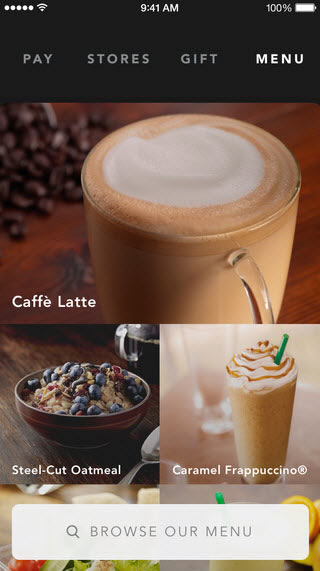
Locate an element on the screen. dark brown wood countertop is located at coordinates (11, 430).